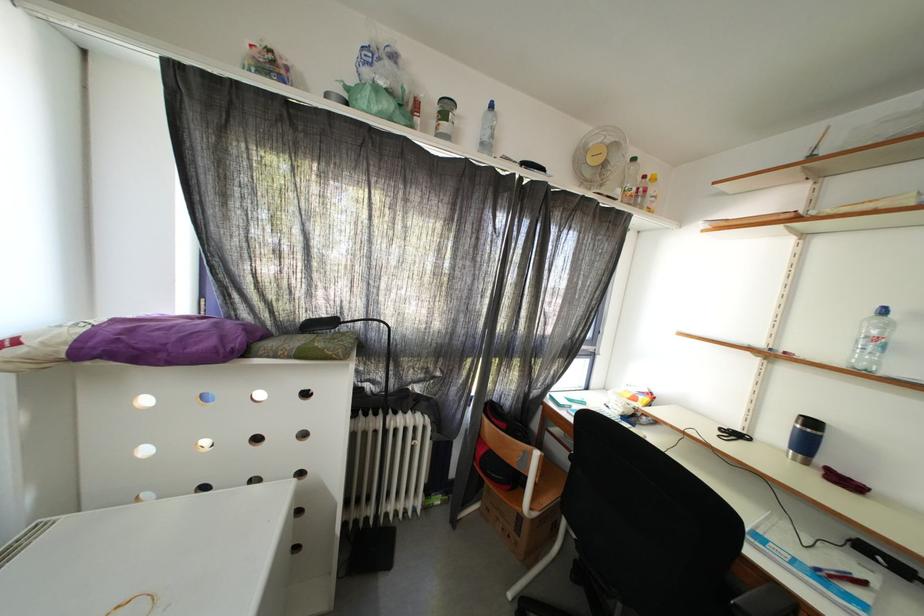
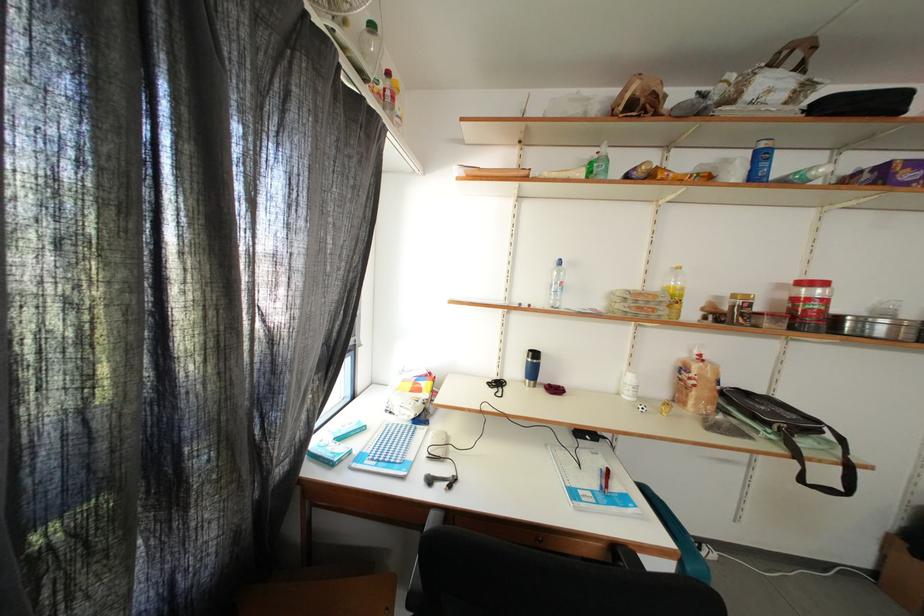
Question: How did the camera likely rotate?

Choices:
 (A) Left
 (B) Right
 (C) Up
 (D) Down

Answer: (B)